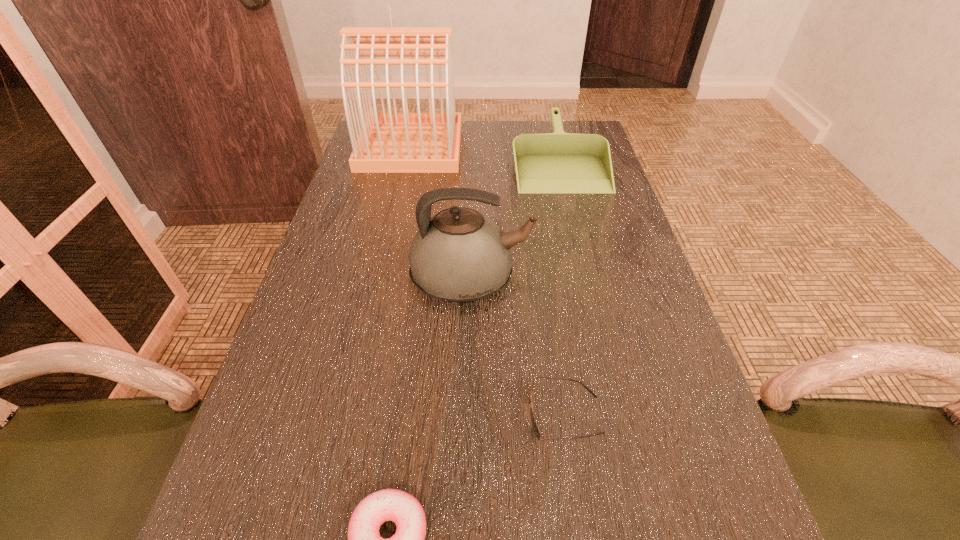
Identify the location of free location located 0.150m on the front-facing side of the sunglasses. This screenshot has width=960, height=540. (441, 415).

You are a GUI agent. You are given a task and a screenshot of the screen. Output one action in this format:
    pyautogui.click(x=<x>, y=<y>)
    Task: Click on the birdcage present at the far edge
    The image size is (960, 540).
    Given the screenshot: What is the action you would take?
    pyautogui.click(x=388, y=142)

This screenshot has width=960, height=540. Identify the location of dustpan situated at the far edge. pos(558,162).

The width and height of the screenshot is (960, 540). In order to click on object located in the left edge section of the desktop in this screenshot , I will do `click(388, 142)`.

Where is `object that is at the right edge`? This screenshot has height=540, width=960. object that is at the right edge is located at coordinates (558, 162).

Where is `object that is at the far left corner`? The image size is (960, 540). object that is at the far left corner is located at coordinates (388, 142).

The width and height of the screenshot is (960, 540). What are the coordinates of `object located at the far right corner` in the screenshot? It's located at (558, 162).

Where is `vacant region at the far edge of the desktop`? vacant region at the far edge of the desktop is located at coordinates (x=465, y=139).

Where is `free space at the left edge of the desktop`? This screenshot has height=540, width=960. free space at the left edge of the desktop is located at coordinates (359, 237).

Find the location of `vacant region at the right edge of the desktop`. vacant region at the right edge of the desktop is located at coordinates (719, 505).